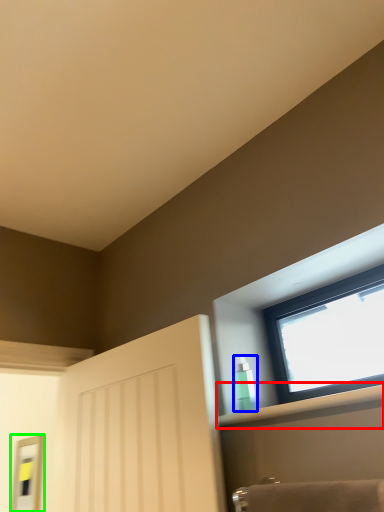
Question: Estimate the real-world distances between objects in this image. Which object is farther from shelf (highlighted by a red box), toiletry (highlighted by a blue box) or mirror (highlighted by a green box)?

Choices:
 (A) toiletry
 (B) mirror

Answer: (B)